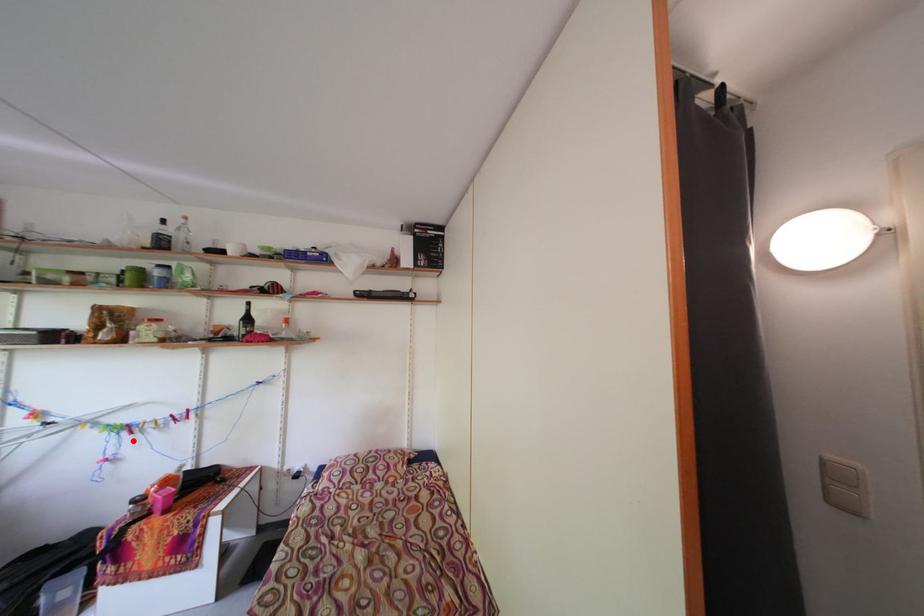
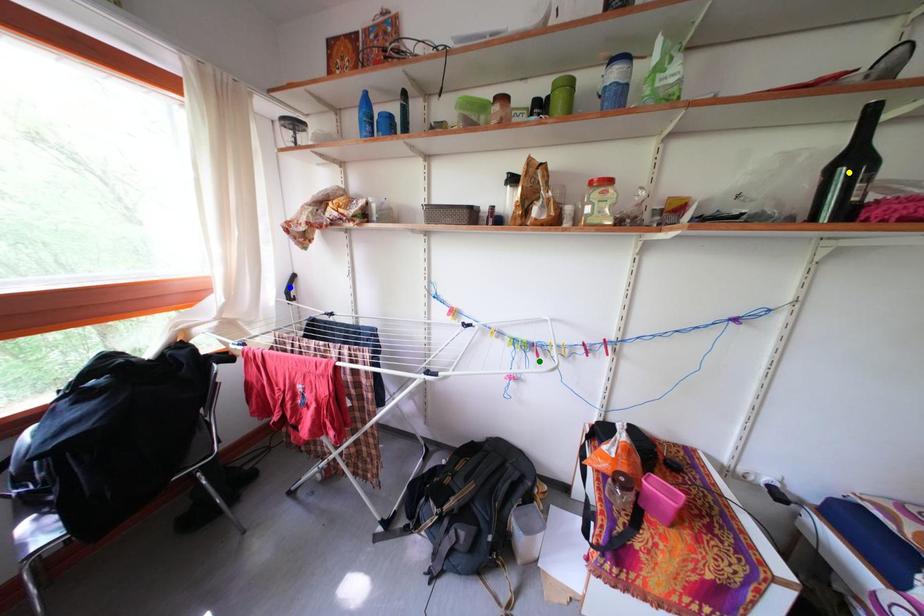
Question: I am providing you with two images of the same scene from different viewpoints. A red point is marked on the first image. You are given multiple points on the second image. Which point in image 2 is actually the same real-world point as the red point in image 1?

Choices:
 (A) yellow point
 (B) green point
 (C) blue point

Answer: (B)